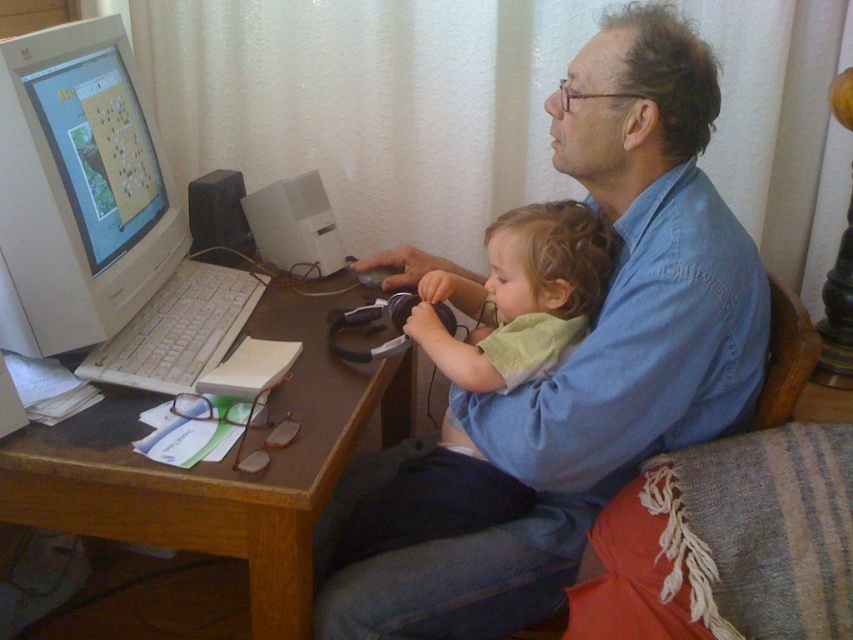
Does blue cotton shirt at upper right have a lesser width compared to light green fabric baby at center?

In fact, blue cotton shirt at upper right might be wider than light green fabric baby at center.

Does point (714, 77) lie in front of point (438, 448)?

Yes, point (714, 77) is closer to viewer.

Who is more distant from viewer, (494, 403) or (457, 529)?

The point (457, 529) is more distant.

Identify the location of blue cotton shirt at upper right. (585, 356).

Consider the image. Can you confirm if white wood computer desk at center is taller than light green fabric baby at center?

No.

Does point (297, 445) come farther from viewer compared to point (602, 230)?

No, (297, 445) is in front of (602, 230).

Which is behind, point (241, 474) or point (524, 499)?

Positioned behind is point (524, 499).

Locate an element on the screen. The image size is (853, 640). white wood computer desk at center is located at coordinates (219, 467).

Is point (675, 44) less distant than point (161, 196)?

Yes, point (675, 44) is closer to viewer.

What are the coordinates of `blue cotton shirt at upper right` in the screenshot? It's located at (585, 356).